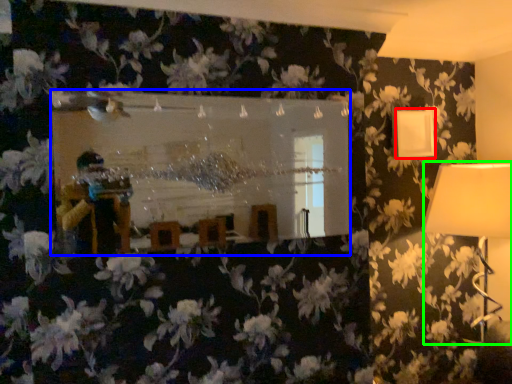
Question: Estimate the real-world distances between objects in this image. Which object is farther from lamp (highlighted by a red box), mirror (highlighted by a blue box) or lamp (highlighted by a green box)?

Choices:
 (A) mirror
 (B) lamp

Answer: (A)